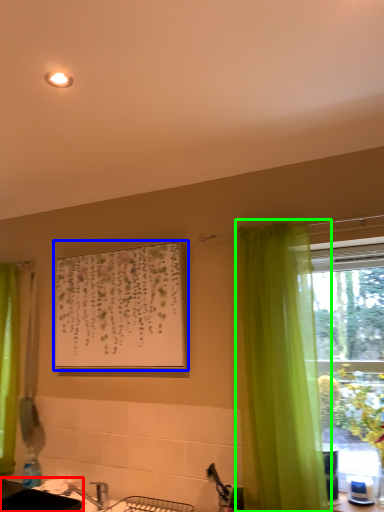
Question: Which object is positioned farthest from sink (highlighted by a red box)? Select from picture frame (highlighted by a blue box) and curtain (highlighted by a green box).

Choices:
 (A) picture frame
 (B) curtain

Answer: (B)